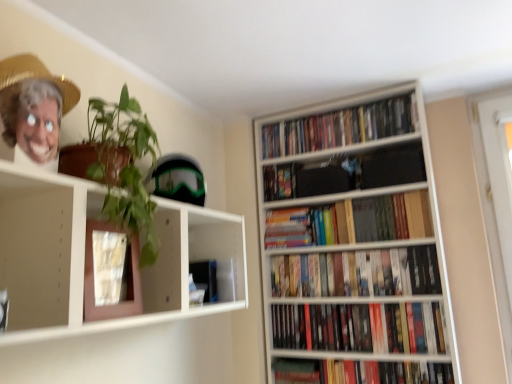
This screenshot has height=384, width=512. What are the coordinates of `free point above hardcover book at lower right, the first book in the bottom-to-top sequence (from a real-world perspective)` in the screenshot? It's located at (381, 358).